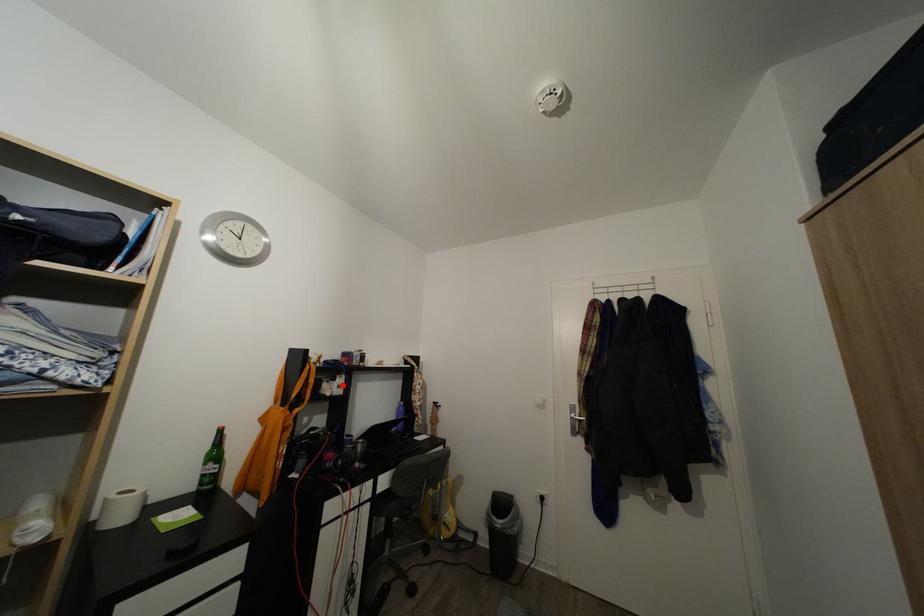
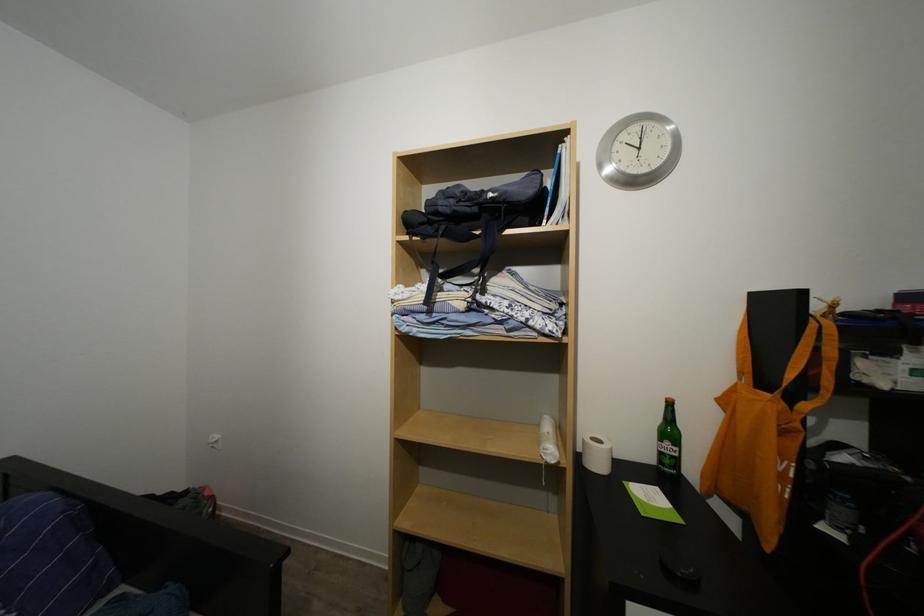
Locate, in the second image, the point that corresponds to the highlighted location in the first image.

(900, 360)